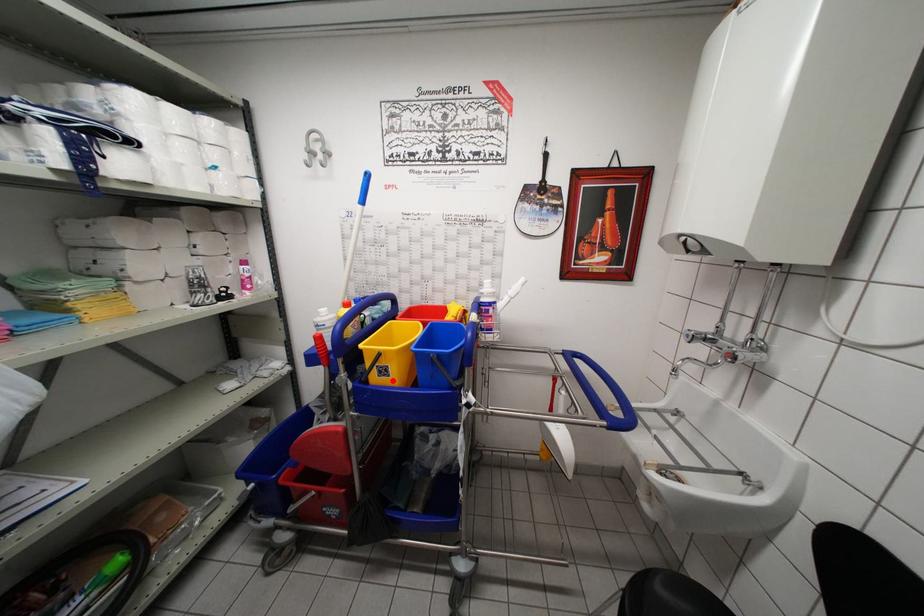
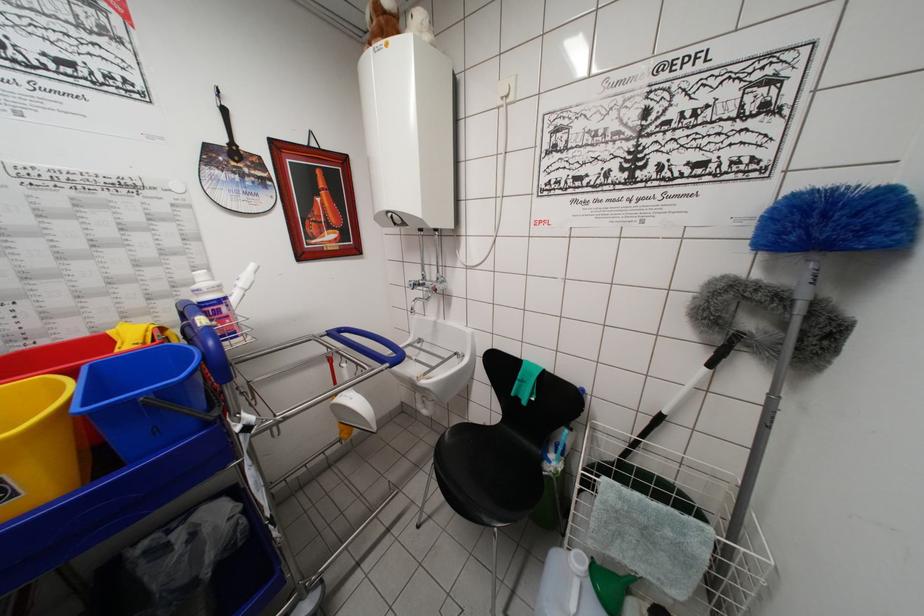
Question: I am providing you with two images of the same scene from different viewpoints. Given a red point in image1, look at the same physical point in image2. Is it:

Choices:
 (A) Closer to the viewpoint
 (B) Farther from the viewpoint

Answer: (A)